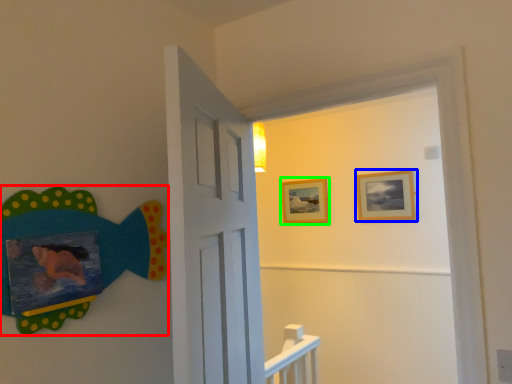
Question: Based on their relative distances, which object is nearer to art (highlighted by a red box)? Choose from picture frame (highlighted by a blue box) and picture frame (highlighted by a green box).

Choices:
 (A) picture frame
 (B) picture frame

Answer: (A)